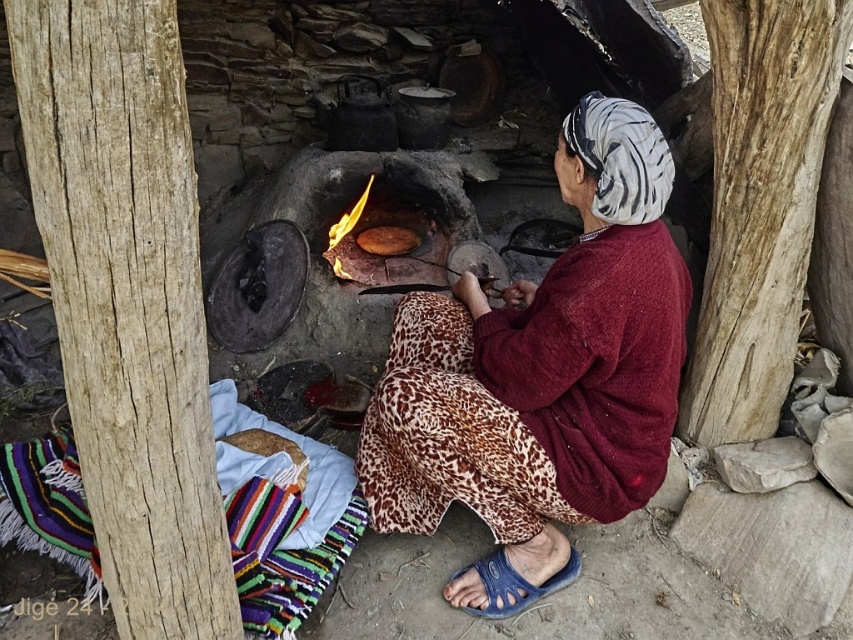
You are standing in the rustic outdoor cooking scene and need to locate the maroon knitted sweater at center. According to the coordinates provided, where exactly would you find it?

The maroon knitted sweater at center is located at point (541, 376), which would be in the central lower portion of the scene.

You are a photographer trying to capture the scene of the woman cooking. You want to ensure both the maroon knitted sweater at center and the brown matte flatbread at center are clearly visible in your photo. Which object should you focus on first to ensure it fits entirely within the frame?

The maroon knitted sweater at center is wider than the brown matte flatbread at center, so you should focus on capturing the maroon knitted sweater at center first to ensure it fits entirely within the frame.